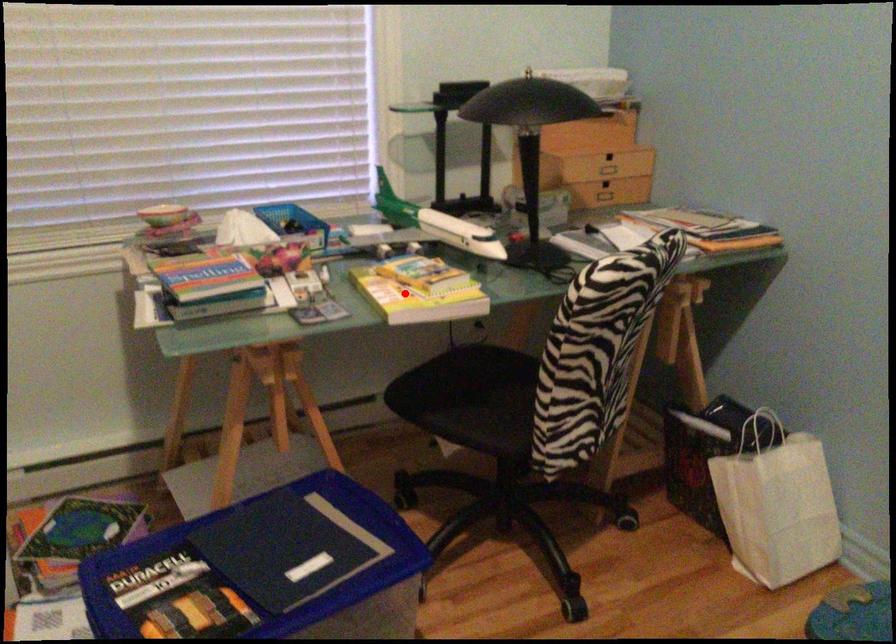
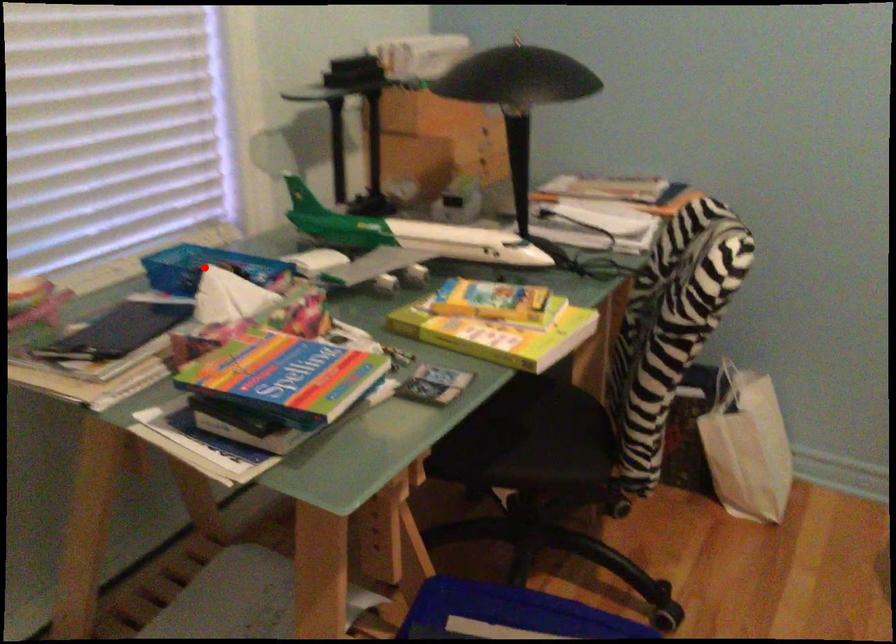
I am providing you with two images of the same scene from different viewpoints. A red point is marked on the first image and another point is marked on the second image. Is the red point in image1 aligned with the point shown in image2?

No